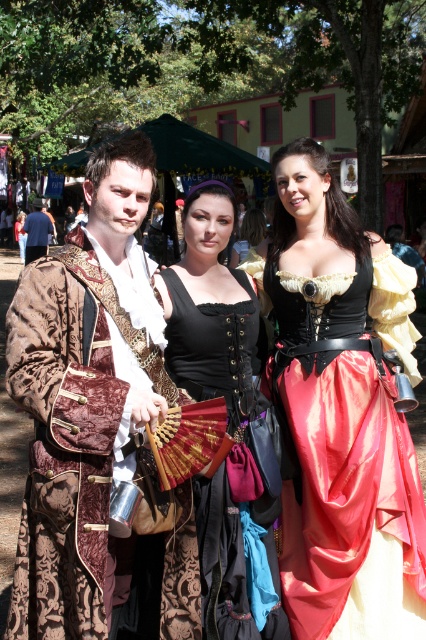
Is satin black corset at center smaller than matte black jacket at center?

Yes.

Which is below, satin black corset at center or matte black jacket at center?

satin black corset at center is lower down.

This screenshot has height=640, width=426. In order to click on satin black corset at center in this screenshot , I will do `click(340, 413)`.

The image size is (426, 640). Find the location of `satin black corset at center`. satin black corset at center is located at coordinates (340, 413).

Who is more distant from viewer, (399, 515) or (111, 280)?

Point (399, 515)

Identify the location of satin black corset at center. The height and width of the screenshot is (640, 426). (340, 413).

Locate an element on the screen. satin black corset at center is located at coordinates (340, 413).

Who is positioned more to the right, velvet brown coat at center or black velvet dress at center?

black velvet dress at center

Is velvet brown coat at center above black velvet dress at center?

Yes, velvet brown coat at center is above black velvet dress at center.

Is point (72, 320) positioned before point (264, 339)?

Yes, it is in front of point (264, 339).

The image size is (426, 640). I want to click on velvet brown coat at center, so click(x=83, y=397).